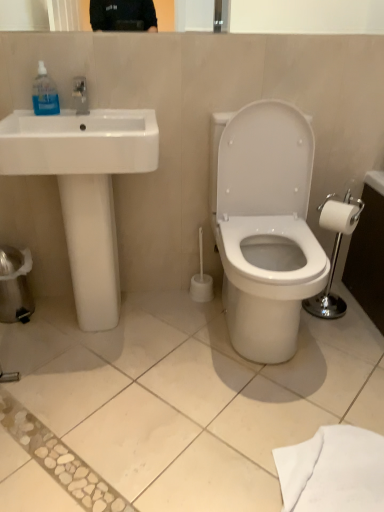
Question: Is white glossy sink at left far from transparent plastic hand sanitizer at upper left?

Choices:
 (A) yes
 (B) no

Answer: (B)

Question: From a real-world perspective, is white glossy sink at left located beneath transparent plastic hand sanitizer at upper left?

Choices:
 (A) no
 (B) yes

Answer: (B)

Question: From a real-world perspective, is white glossy sink at left on top of transparent plastic hand sanitizer at upper left?

Choices:
 (A) yes
 (B) no

Answer: (B)

Question: Considering the relative sizes of white glossy sink at left and transparent plastic hand sanitizer at upper left in the image provided, is white glossy sink at left bigger than transparent plastic hand sanitizer at upper left?

Choices:
 (A) no
 (B) yes

Answer: (B)

Question: Is white glossy sink at left taller than transparent plastic hand sanitizer at upper left?

Choices:
 (A) no
 (B) yes

Answer: (B)

Question: Considering the relative sizes of white glossy sink at left and transparent plastic hand sanitizer at upper left in the image provided, is white glossy sink at left wider than transparent plastic hand sanitizer at upper left?

Choices:
 (A) yes
 (B) no

Answer: (A)

Question: Is transparent plastic hand sanitizer at upper left to the left of white matte toilet paper at right from the viewer's perspective?

Choices:
 (A) yes
 (B) no

Answer: (A)

Question: From the image's perspective, is transparent plastic hand sanitizer at upper left above white matte toilet paper at right?

Choices:
 (A) yes
 (B) no

Answer: (A)

Question: Is transparent plastic hand sanitizer at upper left placed right next to white matte toilet paper at right?

Choices:
 (A) yes
 (B) no

Answer: (B)

Question: Is transparent plastic hand sanitizer at upper left outside white matte toilet paper at right?

Choices:
 (A) yes
 (B) no

Answer: (A)

Question: Is transparent plastic hand sanitizer at upper left bigger than white matte toilet paper at right?

Choices:
 (A) yes
 (B) no

Answer: (B)

Question: Would you say transparent plastic hand sanitizer at upper left is a long distance from white matte toilet paper at right?

Choices:
 (A) yes
 (B) no

Answer: (A)

Question: Can you confirm if white glossy sink at left is thinner than white matte toilet paper at right?

Choices:
 (A) yes
 (B) no

Answer: (B)